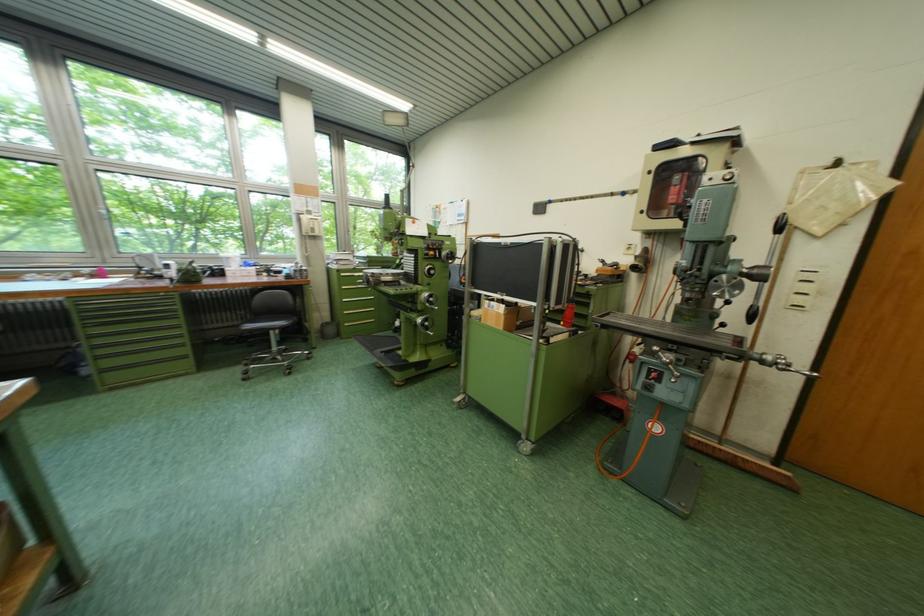
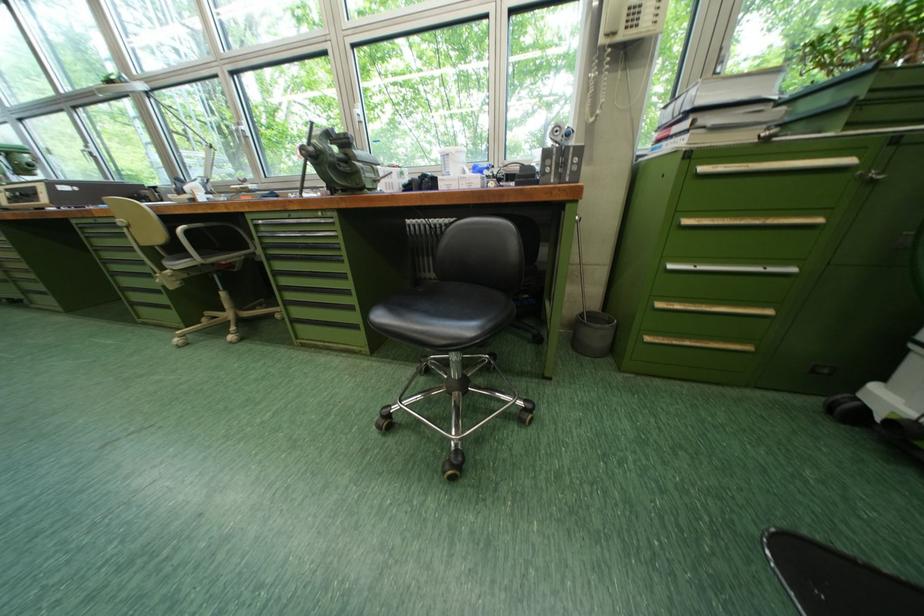
Locate, in the second image, the point that corresponds to point (353, 277) in the first image.

(713, 169)